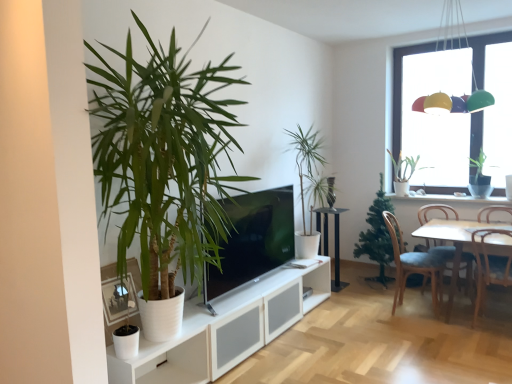
Question: Does white wooden table at right, which is the 1th table in front-to-back order, have a greater width compared to blue fabric chair at lower right, which ranks as the 1th chair in left-to-right order?

Choices:
 (A) yes
 (B) no

Answer: (A)

Question: Does white wooden table at right, marked as the second table in a back-to-front arrangement, have a lesser height compared to blue fabric chair at lower right, which is the fourth chair from right to left?

Choices:
 (A) yes
 (B) no

Answer: (A)

Question: Is white wooden table at right, which is the 1th table in front-to-back order, positioned before blue fabric chair at lower right, which is the fourth chair from right to left?

Choices:
 (A) no
 (B) yes

Answer: (B)

Question: Is white wooden table at right, which is the first table from right to left, outside blue fabric chair at lower right, which ranks as the 1th chair in left-to-right order?

Choices:
 (A) no
 (B) yes

Answer: (B)

Question: From a real-world perspective, is white wooden table at right, which is the first table from right to left, located beneath blue fabric chair at lower right, which ranks as the 1th chair in left-to-right order?

Choices:
 (A) yes
 (B) no

Answer: (A)

Question: In terms of width, does green matte plant at upper right, positioned as the second houseplant in right-to-left order, look wider or thinner when compared to wooden chair at lower right, the second chair from the right?

Choices:
 (A) wide
 (B) thin

Answer: (B)

Question: Considering the positions of green matte plant at upper right, which is the 5th houseplant in front-to-back order, and wooden chair at lower right, the second chair from the right, in the image, is green matte plant at upper right, which is the 5th houseplant in front-to-back order, taller or shorter than wooden chair at lower right, the second chair from the right,?

Choices:
 (A) tall
 (B) short

Answer: (B)

Question: From a real-world perspective, relative to wooden chair at lower right, positioned as the 3th chair in left-to-right order, is green matte plant at upper right, the first houseplant when ordered from back to front, vertically above or below?

Choices:
 (A) below
 (B) above

Answer: (B)

Question: From the image's perspective, is green matte plant at upper right, positioned as the second houseplant in right-to-left order, above or below wooden chair at lower right, positioned as the 3th chair in left-to-right order?

Choices:
 (A) below
 (B) above

Answer: (B)

Question: Is blue fabric chair at lower right, which ranks as the 1th chair in left-to-right order, inside or outside of white wooden table at right, which is the first table from right to left?

Choices:
 (A) inside
 (B) outside

Answer: (A)

Question: Is blue fabric chair at lower right, which ranks as the 1th chair in left-to-right order, in front of or behind white wooden table at right, which is the 1th table in front-to-back order, in the image?

Choices:
 (A) front
 (B) behind

Answer: (B)

Question: From a real-world perspective, is blue fabric chair at lower right, which ranks as the 1th chair in left-to-right order, physically located above or below white wooden table at right, which is the first table from right to left?

Choices:
 (A) above
 (B) below

Answer: (A)

Question: Considering the positions of point (391, 228) and point (428, 231), is point (391, 228) closer or farther from the camera than point (428, 231)?

Choices:
 (A) farther
 (B) closer

Answer: (A)

Question: Does point (241, 235) appear closer or farther from the camera than point (482, 210)?

Choices:
 (A) closer
 (B) farther

Answer: (A)

Question: From the image's perspective, is matte black tv at center above or below brown wooden chair at right, the fourth chair positioned from the left?

Choices:
 (A) above
 (B) below

Answer: (A)